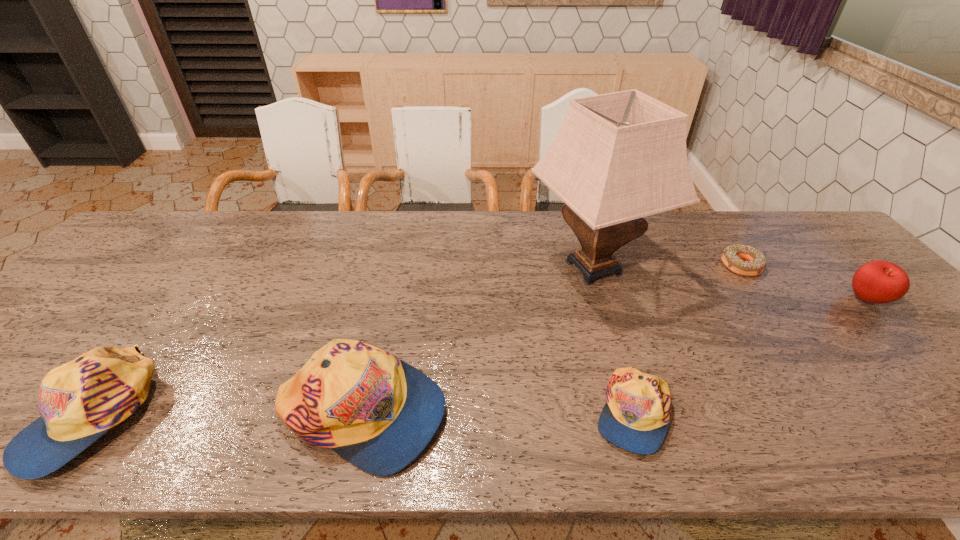
The caps are evenly distributed in the image. To maintain this, where would you place another cap on the right? Please point to a free space. Please provide its 2D coordinates. Your answer should be formatted as a tuple, i.e. [(x, y)], where the tuple contains the x and y coordinates of a point satisfying the conditions above.

[(900, 412)]